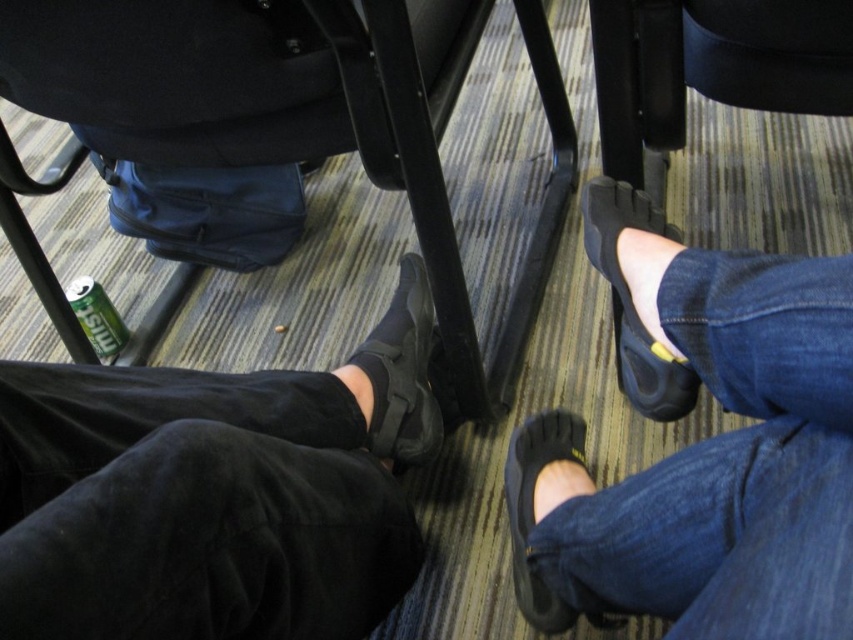
Question: Is black suede shoes at lower right behind black suede shoe at center?

Choices:
 (A) no
 (B) yes

Answer: (A)

Question: Based on their relative distances, which object is farther from the black suede shoe at center?

Choices:
 (A) black suede shoes at lower right
 (B) black suede shoes at lower left

Answer: (A)

Question: Observing the image, what is the correct spatial positioning of black suede shoes at lower right in reference to black suede shoe at lower right?

Choices:
 (A) right
 (B) left

Answer: (A)

Question: Is black suede shoes at lower left to the right of black rubber sandal at lower right from the viewer's perspective?

Choices:
 (A) no
 (B) yes

Answer: (A)

Question: Considering the real-world distances, which object is closest to the black suede shoe at center?

Choices:
 (A) black suede shoes at lower left
 (B) black rubber sandal at lower right
 (C) black suede shoes at lower right

Answer: (A)

Question: Among these objects, which one is farthest from the camera?

Choices:
 (A) black plastic chair at lower left
 (B) black rubber sandal at lower right

Answer: (B)